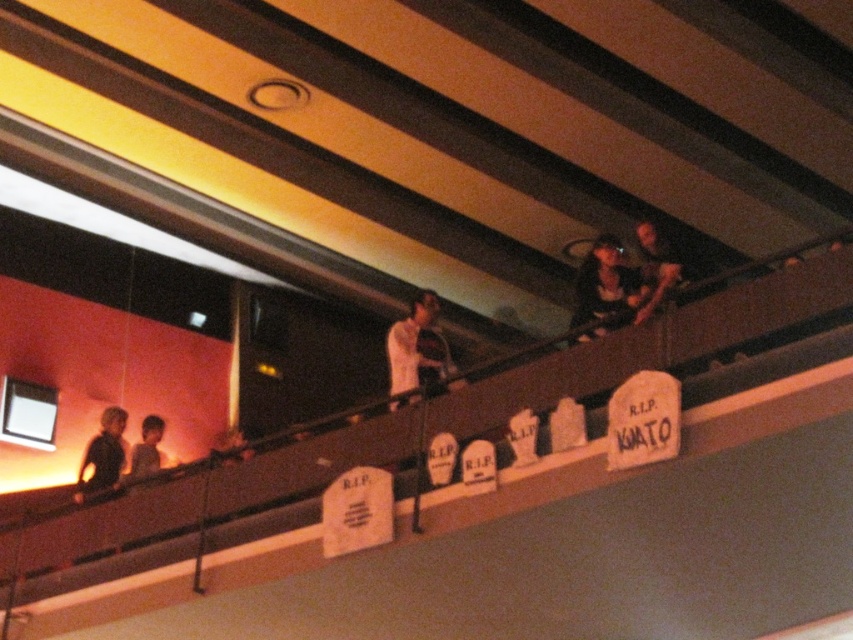
Is black matte shirt at left smaller than smooth skin face at center?

Indeed, black matte shirt at left has a smaller size compared to smooth skin face at center.

Which is above, black matte shirt at left or smooth skin face at center?

smooth skin face at center is higher up.

You are a GUI agent. You are given a task and a screenshot of the screen. Output one action in this format:
    pyautogui.click(x=<x>, y=<y>)
    Task: Click on the black matte shirt at left
    
    Given the screenshot: What is the action you would take?
    pyautogui.click(x=102, y=456)

Can you confirm if smooth skin child at lower left is positioned to the right of smooth skin face at center?

In fact, smooth skin child at lower left is to the left of smooth skin face at center.

Who is positioned more to the right, smooth skin child at lower left or smooth skin face at center?

smooth skin face at center is more to the right.

You are a GUI agent. You are given a task and a screenshot of the screen. Output one action in this format:
    pyautogui.click(x=<x>, y=<y>)
    Task: Click on the smooth skin child at lower left
    The width and height of the screenshot is (853, 640).
    Given the screenshot: What is the action you would take?
    pyautogui.click(x=148, y=449)

Can you confirm if white matte shirt at center is wider than smooth skin face at center?

No, white matte shirt at center is not wider than smooth skin face at center.

Which is more to the right, white matte shirt at center or smooth skin face at center?

Positioned to the right is white matte shirt at center.

Is point (444, 380) positioned in front of point (228, 433)?

Yes, point (444, 380) is in front of point (228, 433).

At what (x,y) coordinates should I click in order to perform the action: click on white matte shirt at center. Please return your answer as a coordinate pair (x, y). Looking at the image, I should click on (416, 352).